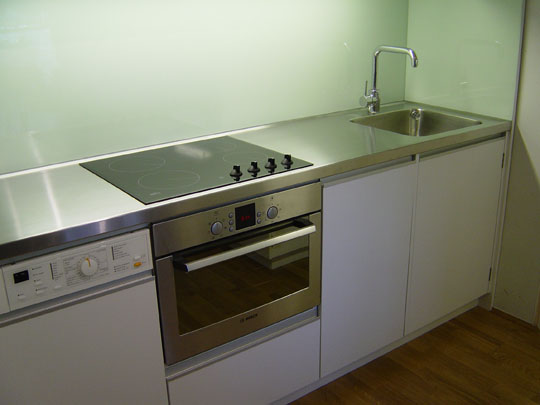
Locate an element on the screen. This screenshot has height=405, width=540. oven door is located at coordinates (247, 286).